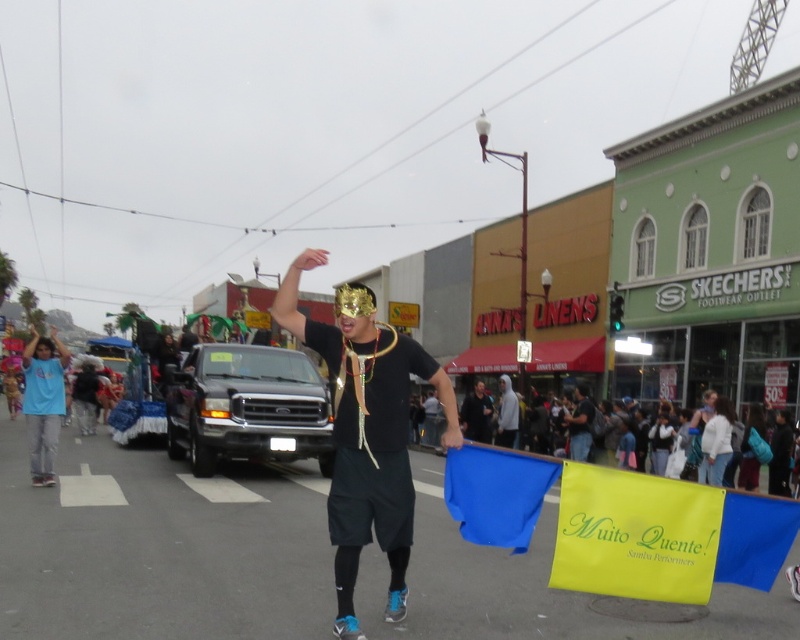
Question: Is black matte mask at center positioned in front of black fabric mask at center?

Choices:
 (A) yes
 (B) no

Answer: (A)

Question: Does black matte mask at center appear over light blue t-shirt at left?

Choices:
 (A) no
 (B) yes

Answer: (B)

Question: Can you confirm if light blue t-shirt at left is positioned to the right of black fabric mask at center?

Choices:
 (A) yes
 (B) no

Answer: (B)

Question: Estimate the real-world distances between objects in this image. Which object is closer to the black matte mask at center?

Choices:
 (A) light blue t-shirt at left
 (B) black fabric mask at center

Answer: (A)

Question: Which object appears farthest from the camera in this image?

Choices:
 (A) black fabric mask at center
 (B) light blue t-shirt at left

Answer: (A)

Question: Which object is the closest to the light blue t-shirt at left?

Choices:
 (A) black fabric mask at center
 (B) black matte mask at center

Answer: (B)